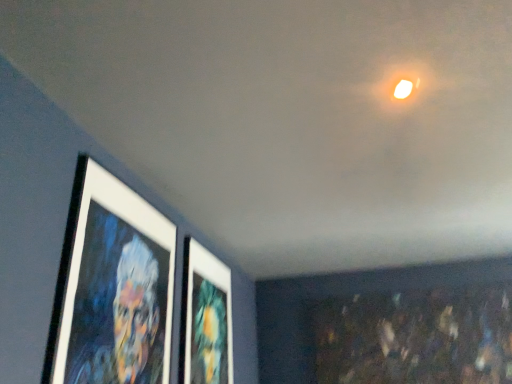
Question: Does matte white picture frame at center, the first picture frame in the back-to-front sequence, have a larger size compared to white matte picture frame at left, placed as the second picture frame when sorted from right to left?

Choices:
 (A) yes
 (B) no

Answer: (A)

Question: Is there a large distance between matte white picture frame at center, arranged as the 2th picture frame when viewed from the front, and white matte picture frame at left, marked as the 1th picture frame in a left-to-right arrangement?

Choices:
 (A) no
 (B) yes

Answer: (A)

Question: Is matte white picture frame at center, placed as the 1th picture frame when sorted from right to left, turned away from white matte picture frame at left, placed as the 1th picture frame when sorted from front to back?

Choices:
 (A) yes
 (B) no

Answer: (B)

Question: From the image's perspective, is matte white picture frame at center, arranged as the 2th picture frame when viewed from the front, located above white matte picture frame at left, marked as the 1th picture frame in a left-to-right arrangement?

Choices:
 (A) no
 (B) yes

Answer: (A)

Question: Considering the relative sizes of matte white picture frame at center, arranged as the 2th picture frame when viewed from the front, and white matte picture frame at left, placed as the second picture frame when sorted from right to left, in the image provided, is matte white picture frame at center, arranged as the 2th picture frame when viewed from the front, taller than white matte picture frame at left, placed as the second picture frame when sorted from right to left,?

Choices:
 (A) no
 (B) yes

Answer: (A)

Question: Does matte white picture frame at center, the first picture frame in the back-to-front sequence, have a greater width compared to white matte picture frame at left, placed as the 1th picture frame when sorted from front to back?

Choices:
 (A) no
 (B) yes

Answer: (B)

Question: Can you confirm if white matte picture frame at left, placed as the second picture frame when sorted from right to left, is positioned to the left of matte white picture frame at center, placed as the 1th picture frame when sorted from right to left?

Choices:
 (A) no
 (B) yes

Answer: (B)

Question: From a real-world perspective, is white matte picture frame at left, the 2th picture frame from the back, located higher than matte white picture frame at center, arranged as the 2th picture frame when viewed from the front?

Choices:
 (A) yes
 (B) no

Answer: (B)

Question: Could you tell me if white matte picture frame at left, the 2th picture frame from the back, is turned towards matte white picture frame at center, arranged as the 2th picture frame when viewed from the front?

Choices:
 (A) yes
 (B) no

Answer: (B)

Question: Is white matte picture frame at left, marked as the 1th picture frame in a left-to-right arrangement, oriented away from matte white picture frame at center, arranged as the 2th picture frame when viewed from the front?

Choices:
 (A) no
 (B) yes

Answer: (A)

Question: Is white matte picture frame at left, marked as the 1th picture frame in a left-to-right arrangement, shorter than matte white picture frame at center, acting as the 2th picture frame starting from the left?

Choices:
 (A) yes
 (B) no

Answer: (B)

Question: Is white matte picture frame at left, marked as the 1th picture frame in a left-to-right arrangement, outside matte white picture frame at center, placed as the 1th picture frame when sorted from right to left?

Choices:
 (A) yes
 (B) no

Answer: (A)

Question: From the image's perspective, is matte white picture frame at center, placed as the 1th picture frame when sorted from right to left, located above or below white matte picture frame at left, placed as the second picture frame when sorted from right to left?

Choices:
 (A) below
 (B) above

Answer: (A)